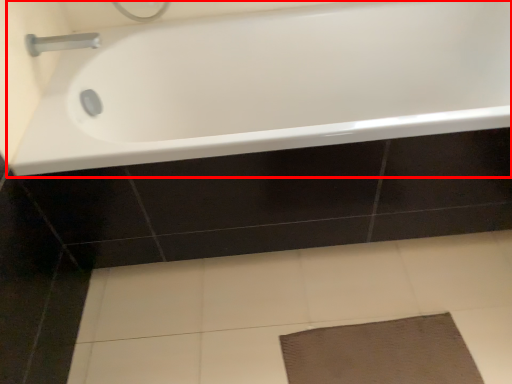
Question: In this image, where is bathtub (annotated by the red box) located relative to tap?

Choices:
 (A) right
 (B) left

Answer: (A)